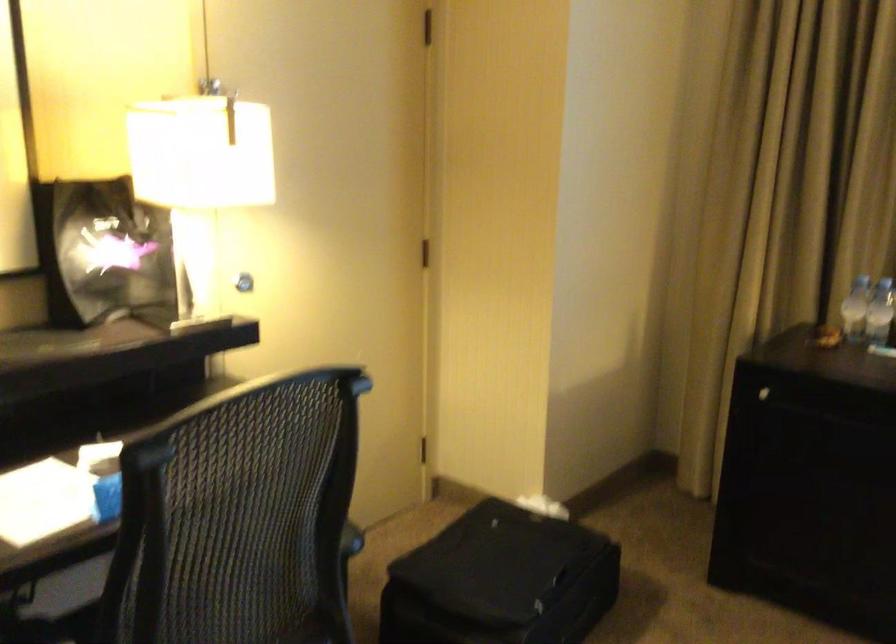
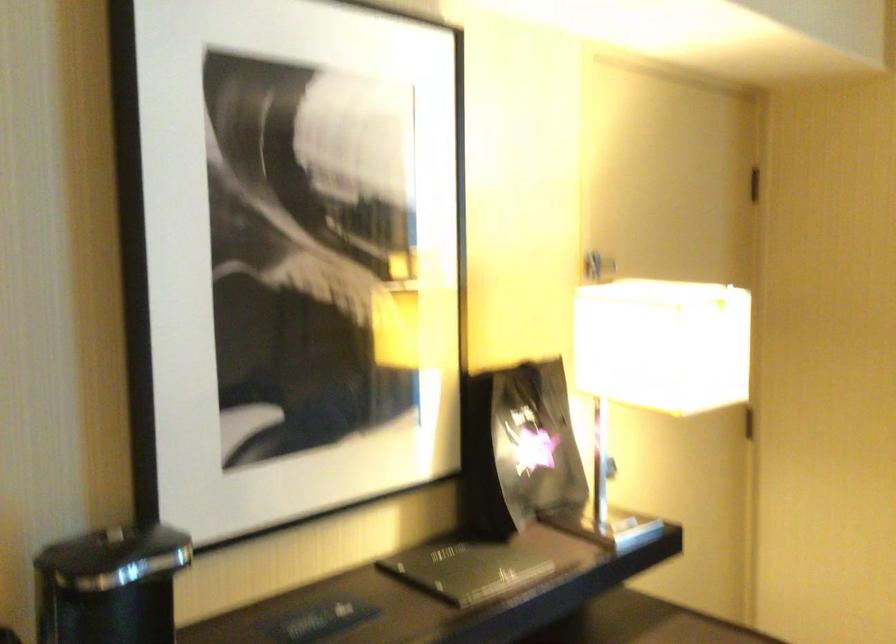
Question: The images are taken continuously from a first-person perspective. In which direction are you moving?

Choices:
 (A) Left
 (B) Right
 (C) Forward
 (D) Backward

Answer: (A)